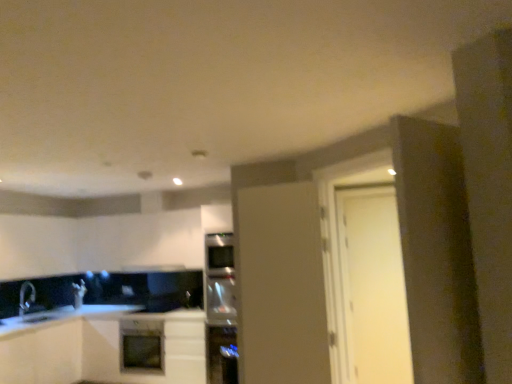
Question: From a real-world perspective, relative to white matte cabinet at center, marked as the second cabinetry in a left-to-right arrangement, is white matte door at right, the first door in the right-to-left sequence, vertically above or below?

Choices:
 (A) above
 (B) below

Answer: (A)

Question: Considering their positions, is white matte door at right, marked as the second door in a front-to-back arrangement, located in front of or behind white matte cabinet at center, marked as the second cabinetry in a left-to-right arrangement?

Choices:
 (A) front
 (B) behind

Answer: (A)

Question: Based on their relative distances, which object is nearer to the white matte cabinet at center, marked as the second cabinetry in a left-to-right arrangement?

Choices:
 (A) matte white oven at center
 (B) black matte exhaust hood at center
 (C) white matte cabinet at lower left, which is counted as the second cabinetry, starting from the right
 (D) sleek metallic fridge at center, the first appliance in the bottom-to-top sequence
 (E) matte white door at center, the second door from the right

Answer: (C)

Question: Estimate the real-world distances between objects in this image. Which object is closer to the sleek metallic fridge at center, the second appliance when ordered from top to bottom?

Choices:
 (A) matte white door at center, positioned as the 1th door in front-to-back order
 (B) black matte exhaust hood at center
 (C) white matte cabinet at center, positioned as the 1th cabinetry in right-to-left order
 (D) white matte cabinet at lower left, which is counted as the second cabinetry, starting from the right
 (E) white matte door at right, the first door in the right-to-left sequence

Answer: (C)